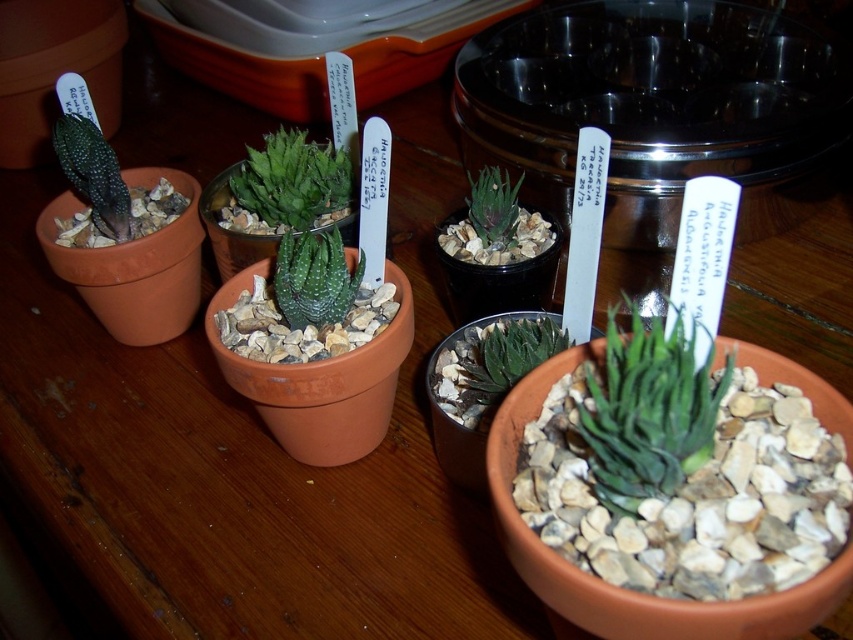
Question: Does green matte succulent at center have a larger size compared to green succulent at center?

Choices:
 (A) yes
 (B) no

Answer: (B)

Question: Does green matte succulent at center come behind green succulent at center?

Choices:
 (A) no
 (B) yes

Answer: (A)

Question: Among these objects, which one is farthest from the camera?

Choices:
 (A) green matte succulent at center
 (B) green succulent at center

Answer: (B)

Question: Does green matte succulent at center come behind green succulent at center?

Choices:
 (A) yes
 (B) no

Answer: (B)

Question: Which point is farther to the camera?

Choices:
 (A) (601, 380)
 (B) (248, 186)

Answer: (B)